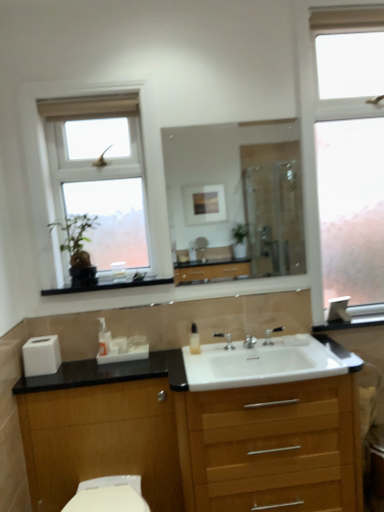
Question: From the image's perspective, is translucent plastic soap dispenser at center, arranged as the 1th soap dispenser when viewed from the left, above silver metallic tap at center, the 2th tap positioned from the right?

Choices:
 (A) no
 (B) yes

Answer: (B)

Question: Can you confirm if translucent plastic soap dispenser at center, marked as the second soap dispenser in a right-to-left arrangement, is smaller than silver metallic tap at center, marked as the 1th tap in a left-to-right arrangement?

Choices:
 (A) yes
 (B) no

Answer: (B)

Question: Considering the relative sizes of translucent plastic soap dispenser at center, marked as the second soap dispenser in a right-to-left arrangement, and silver metallic tap at center, marked as the 1th tap in a left-to-right arrangement, in the image provided, is translucent plastic soap dispenser at center, marked as the second soap dispenser in a right-to-left arrangement, thinner than silver metallic tap at center, marked as the 1th tap in a left-to-right arrangement,?

Choices:
 (A) no
 (B) yes

Answer: (A)

Question: Is translucent plastic soap dispenser at center, arranged as the 1th soap dispenser when viewed from the left, positioned with its back to silver metallic tap at center, the 2th tap positioned from the right?

Choices:
 (A) yes
 (B) no

Answer: (B)

Question: Is translucent plastic soap dispenser at center, marked as the second soap dispenser in a right-to-left arrangement, shorter than silver metallic tap at center, marked as the 1th tap in a left-to-right arrangement?

Choices:
 (A) no
 (B) yes

Answer: (A)

Question: Choose the correct answer: Is white matte toilet paper at lower left inside translucent plastic soap dispenser at center, arranged as the 1th soap dispenser when viewed from the left, or outside it?

Choices:
 (A) outside
 (B) inside

Answer: (A)

Question: In terms of width, does white matte toilet paper at lower left look wider or thinner when compared to translucent plastic soap dispenser at center, arranged as the 1th soap dispenser when viewed from the left?

Choices:
 (A) wide
 (B) thin

Answer: (A)

Question: From a real-world perspective, is white matte toilet paper at lower left above or below translucent plastic soap dispenser at center, marked as the second soap dispenser in a right-to-left arrangement?

Choices:
 (A) above
 (B) below

Answer: (B)

Question: Considering the positions of white matte toilet paper at lower left and translucent plastic soap dispenser at center, arranged as the 1th soap dispenser when viewed from the left, in the image, is white matte toilet paper at lower left bigger or smaller than translucent plastic soap dispenser at center, arranged as the 1th soap dispenser when viewed from the left,?

Choices:
 (A) big
 (B) small

Answer: (A)

Question: Visually, is white matte toilet paper at lower left positioned to the left or to the right of wooden cabinet at lower center?

Choices:
 (A) right
 (B) left

Answer: (B)

Question: In terms of width, does white matte toilet paper at lower left look wider or thinner when compared to wooden cabinet at lower center?

Choices:
 (A) wide
 (B) thin

Answer: (B)

Question: From a real-world perspective, relative to wooden cabinet at lower center, is white matte toilet paper at lower left vertically above or below?

Choices:
 (A) below
 (B) above

Answer: (B)

Question: Based on their sizes in the image, would you say white matte toilet paper at lower left is bigger or smaller than wooden cabinet at lower center?

Choices:
 (A) small
 (B) big

Answer: (A)

Question: From the image's perspective, is translucent plastic soap dispenser at center, marked as the 1th soap dispenser in a right-to-left arrangement, positioned above or below frosted glass window at right, acting as the first window starting from the right?

Choices:
 (A) below
 (B) above

Answer: (A)

Question: Would you say translucent plastic soap dispenser at center, acting as the second soap dispenser starting from the left, is inside or outside frosted glass window at right, arranged as the second window when viewed from the left?

Choices:
 (A) inside
 (B) outside

Answer: (B)